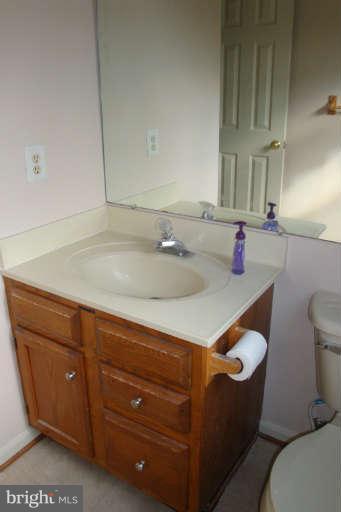
The width and height of the screenshot is (341, 512). I want to click on vanity, so click(x=90, y=341).